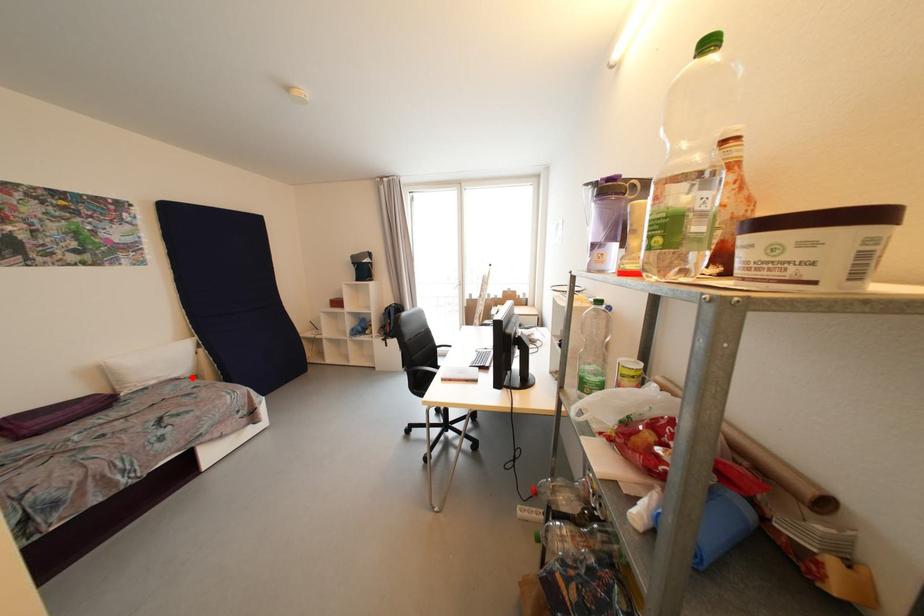
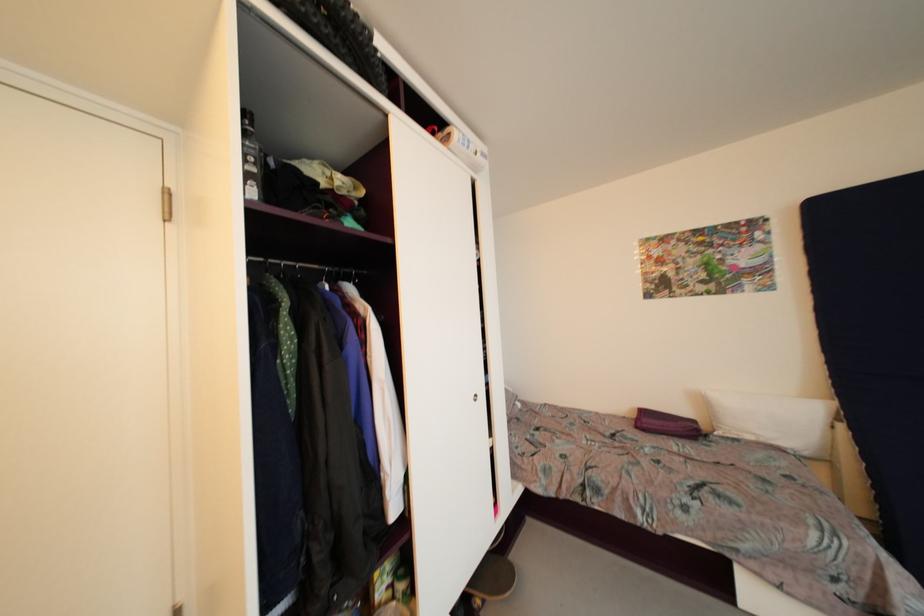
Question: I am providing you with two images of the same scene from different viewpoints. In image1, a red point is highlighted. Considering the same 3D point in image2, which of the following is correct?

Choices:
 (A) It is closer
 (B) It is farther

Answer: (B)